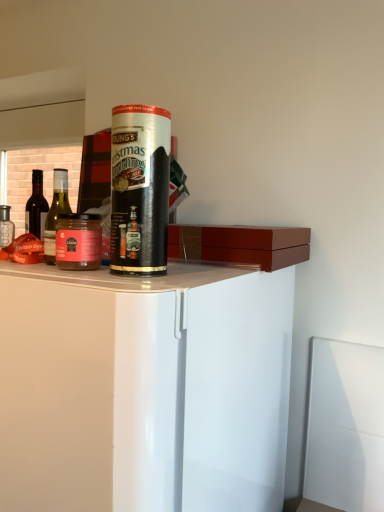
What do you see at coordinates (144, 389) in the screenshot?
I see `white glossy cabinet at center` at bounding box center [144, 389].

The width and height of the screenshot is (384, 512). I want to click on transparent plastic straw at center, so click(x=139, y=189).

From a real-world perspective, does white glossy cabinet at center stand above matte glass bottle at left, the 2th bottle from the front?

No.

Between white glossy cabinet at center and matte glass bottle at left, the 2th bottle when ordered from right to left, which one has larger width?

With larger width is white glossy cabinet at center.

Does white glossy cabinet at center have a greater height compared to matte glass bottle at left, the first bottle in the left-to-right sequence?

Correct, white glossy cabinet at center is much taller as matte glass bottle at left, the first bottle in the left-to-right sequence.

Relative to matte glass bottle at left, the 2th bottle when ordered from right to left, is white glossy cabinet at center in front or behind?

Visually, white glossy cabinet at center is located in front of matte glass bottle at left, the 2th bottle when ordered from right to left.

Are green glass bottle at left, acting as the 1th bottle starting from the front, and matte glass jar at left far apart?

green glass bottle at left, acting as the 1th bottle starting from the front, is far away from matte glass jar at left.

Between point (46, 234) and point (92, 227), which one is positioned in front?

The point (92, 227) is closer to the camera.

Would you say green glass bottle at left, positioned as the 1th bottle in right-to-left order, is to the left or to the right of matte glass jar at left in the picture?

Clearly, green glass bottle at left, positioned as the 1th bottle in right-to-left order, is on the left of matte glass jar at left in the image.

Which of these two, green glass bottle at left, which is the second bottle in back-to-front order, or matte glass jar at left, is smaller?

green glass bottle at left, which is the second bottle in back-to-front order, is smaller.

Is white glossy cabinet at center at the left side of green glass bottle at left, which is the 2th bottle from left to right?

No, white glossy cabinet at center is not to the left of green glass bottle at left, which is the 2th bottle from left to right.

From a real-world perspective, count 1st bottles upward from the white glossy cabinet at center and point to it. Please provide its 2D coordinates.

[(56, 213)]

Between white glossy cabinet at center and green glass bottle at left, acting as the 1th bottle starting from the front, which one has larger width?

Wider between the two is white glossy cabinet at center.

In the image, is white glossy cabinet at center positioned in front of or behind matte glass jar at left?

In the image, white glossy cabinet at center appears in front of matte glass jar at left.

Between white glossy cabinet at center and matte glass jar at left, which one has less height?

matte glass jar at left.

Locate an element on the screen. Image resolution: width=384 pixels, height=512 pixels. cabinetry that appears on the right of matte glass jar at left is located at coordinates (144, 389).

Would you say white glossy cabinet at center is to the left or to the right of matte glass jar at left in the picture?

Clearly, white glossy cabinet at center is on the right of matte glass jar at left in the image.

How many degrees apart are the facing directions of matte glass bottle at left, the 2th bottle from the front, and white glossy cabinet at center?

matte glass bottle at left, the 2th bottle from the front, and white glossy cabinet at center are facing 0.444 degrees away from each other.

Measure the distance between matte glass bottle at left, the 2th bottle from the front, and white glossy cabinet at center.

matte glass bottle at left, the 2th bottle from the front, and white glossy cabinet at center are 17.00 inches apart from each other.

Is matte glass bottle at left, which is the 1th bottle from back to front, positioned with its back to white glossy cabinet at center?

No.

Does point (42, 204) come behind point (103, 354)?

That is True.

Can you confirm if matte glass jar at left is positioned to the left of transparent plastic straw at center?

Yes, matte glass jar at left is to the left of transparent plastic straw at center.

From the image's perspective, is matte glass jar at left located above or below transparent plastic straw at center?

Clearly, from the image's perspective, matte glass jar at left is below transparent plastic straw at center.

Between matte glass jar at left and transparent plastic straw at center, which one has more height?

transparent plastic straw at center.

What's the angular difference between matte glass jar at left and transparent plastic straw at center's facing directions?

matte glass jar at left and transparent plastic straw at center are facing 0.00488 degrees away from each other.

Measure the distance between green glass bottle at left, positioned as the 1th bottle in right-to-left order, and white glossy cabinet at center.

green glass bottle at left, positioned as the 1th bottle in right-to-left order, is 1.71 meters from white glossy cabinet at center.

Considering the sizes of objects green glass bottle at left, acting as the 1th bottle starting from the front, and white glossy cabinet at center in the image provided, who is thinner, green glass bottle at left, acting as the 1th bottle starting from the front, or white glossy cabinet at center?

green glass bottle at left, acting as the 1th bottle starting from the front, is thinner.

Is green glass bottle at left, positioned as the 1th bottle in right-to-left order, taller than white glossy cabinet at center?

No, green glass bottle at left, positioned as the 1th bottle in right-to-left order, is not taller than white glossy cabinet at center.

From the image's perspective, which object appears higher, green glass bottle at left, which is the second bottle in back-to-front order, or white glossy cabinet at center?

green glass bottle at left, which is the second bottle in back-to-front order, appears higher in the image.

Where is `cabinetry below the matte glass bottle at left, the first bottle in the left-to-right sequence (from the image's perspective)`? The width and height of the screenshot is (384, 512). cabinetry below the matte glass bottle at left, the first bottle in the left-to-right sequence (from the image's perspective) is located at coordinates (144, 389).

Find the location of a particular element. The height and width of the screenshot is (512, 384). the 1st bottle counting from the left of the matte glass jar at left is located at coordinates pos(56,213).

Considering their positions, is green glass bottle at left, acting as the 1th bottle starting from the front, positioned further to matte glass bottle at left, the 2th bottle when ordered from right to left, than transparent plastic straw at center?

The object further to matte glass bottle at left, the 2th bottle when ordered from right to left, is green glass bottle at left, acting as the 1th bottle starting from the front.

Looking at the image, which one is located closer to matte glass bottle at left, the 2th bottle from the front, transparent plastic straw at center or matte glass jar at left?

Among the two, matte glass jar at left is located nearer to matte glass bottle at left, the 2th bottle from the front.

Looking at the image, which one is located further to transparent plastic straw at center, white glossy cabinet at center or matte glass jar at left?

white glossy cabinet at center.

Looking at the image, which one is located further to green glass bottle at left, acting as the 1th bottle starting from the front, matte glass bottle at left, which is the 1th bottle from back to front, or white glossy cabinet at center?

white glossy cabinet at center lies further to green glass bottle at left, acting as the 1th bottle starting from the front, than the other object.

When comparing their distances from matte glass bottle at left, the first bottle in the left-to-right sequence, does matte glass jar at left or transparent plastic straw at center seem further?

Among the two, transparent plastic straw at center is located further to matte glass bottle at left, the first bottle in the left-to-right sequence.

Looking at the image, which one is located further to matte glass jar at left, white glossy cabinet at center or transparent plastic straw at center?

white glossy cabinet at center is further to matte glass jar at left.

When comparing their distances from white glossy cabinet at center, does matte glass jar at left or transparent plastic straw at center seem further?

The object further to white glossy cabinet at center is matte glass jar at left.

Considering their positions, is matte glass jar at left positioned closer to green glass bottle at left, acting as the 1th bottle starting from the front, than white glossy cabinet at center?

Result: matte glass jar at left is positioned closer to the anchor green glass bottle at left, acting as the 1th bottle starting from the front.

Locate an element on the screen. bottle located between transparent plastic straw at center and matte glass bottle at left, the 2th bottle when ordered from right to left, in the depth direction is located at coordinates (56, 213).

This screenshot has height=512, width=384. I want to click on beverage between green glass bottle at left, acting as the 1th bottle starting from the front, and white glossy cabinet at center vertically, so click(x=78, y=242).

Where is `bottle between matte glass bottle at left, which is the 1th bottle from back to front, and white glossy cabinet at center in the up-down direction`? This screenshot has height=512, width=384. bottle between matte glass bottle at left, which is the 1th bottle from back to front, and white glossy cabinet at center in the up-down direction is located at coordinates [x=56, y=213].

You are a GUI agent. You are given a task and a screenshot of the screen. Output one action in this format:
    pyautogui.click(x=<x>, y=<y>)
    Task: Click on the bottle between matte glass jar at left and matte glass bottle at left, the 2th bottle when ordered from right to left, along the z-axis
    This screenshot has width=384, height=512.
    Given the screenshot: What is the action you would take?
    pyautogui.click(x=56, y=213)